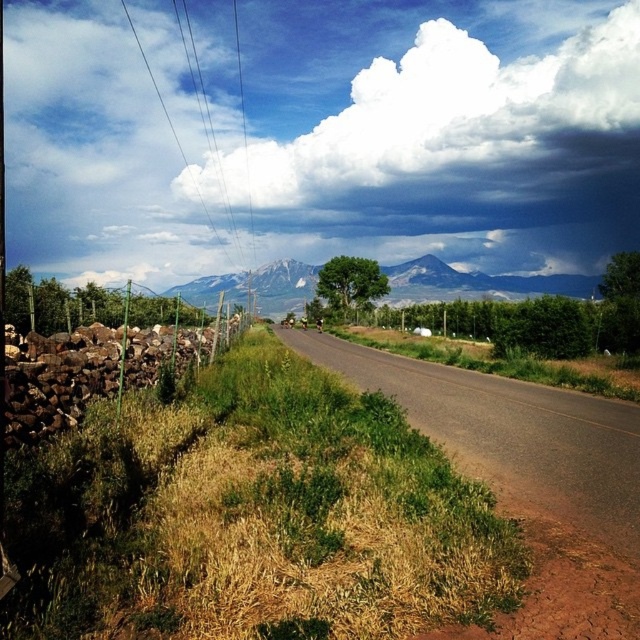
Question: Does white fluffy cloud at upper center appear on the right side of gray rocky mountain at center?

Choices:
 (A) no
 (B) yes

Answer: (B)

Question: Can you confirm if white fluffy cloud at upper center is thinner than gray rocky mountain at center?

Choices:
 (A) yes
 (B) no

Answer: (B)

Question: Is white fluffy cloud at upper center to the right of gray rocky mountain at center from the viewer's perspective?

Choices:
 (A) yes
 (B) no

Answer: (A)